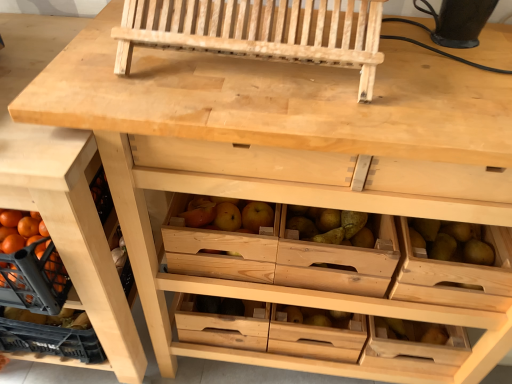
The width and height of the screenshot is (512, 384). Find the location of `vacant location below natural wood church bench at upper center (from a real-world perspective)`. vacant location below natural wood church bench at upper center (from a real-world perspective) is located at coordinates (251, 71).